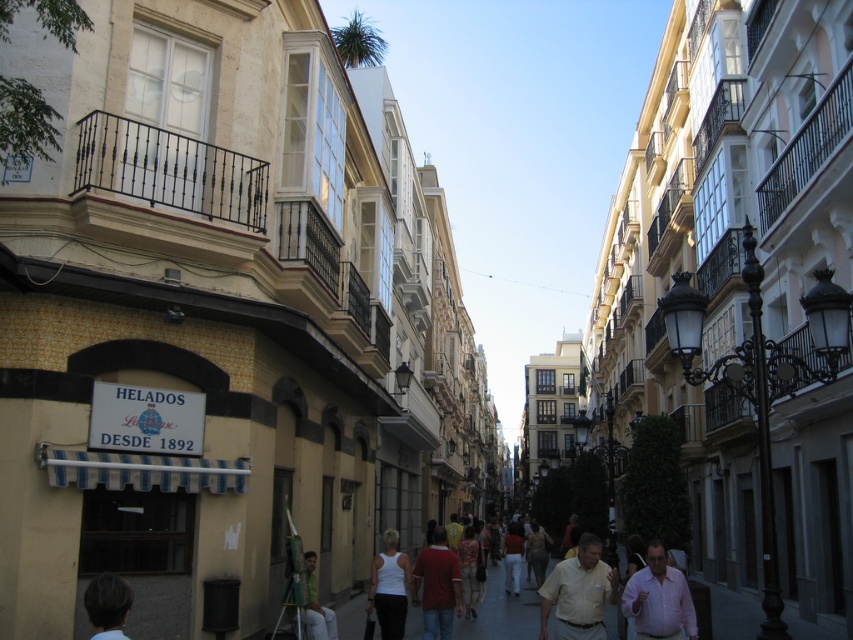
The height and width of the screenshot is (640, 853). What do you see at coordinates (107, 605) in the screenshot?
I see `light brown hair at lower left` at bounding box center [107, 605].

Is light brown hair at lower left thinner than green fabric shirt at lower center?

Incorrect, light brown hair at lower left's width is not less than green fabric shirt at lower center's.

This screenshot has width=853, height=640. What do you see at coordinates (107, 605) in the screenshot?
I see `light brown hair at lower left` at bounding box center [107, 605].

I want to click on light brown hair at lower left, so click(107, 605).

Looking at this image, is light brown shirt at center further to camera compared to pink cotton shirt at center?

That is True.

From the picture: Who is more forward, (579, 564) or (648, 595)?

Point (648, 595) is in front.

Where is `light brown shirt at center`? This screenshot has height=640, width=853. light brown shirt at center is located at coordinates (579, 593).

Is point (606, 598) closer to viewer compared to point (427, 593)?

Yes, point (606, 598) is closer to viewer.

Locate an element on the screen. The height and width of the screenshot is (640, 853). light brown shirt at center is located at coordinates (579, 593).